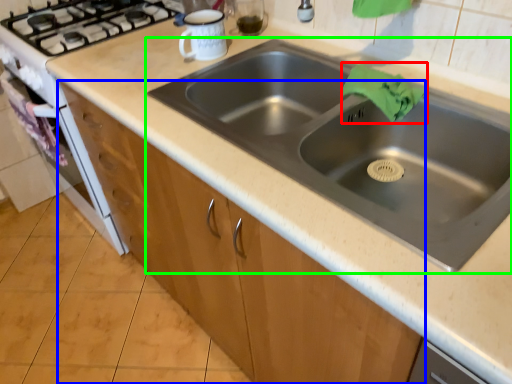
Question: Which is farther away from cloth (highlighted by a red box)? cabinetry (highlighted by a blue box) or sink (highlighted by a green box)?

Choices:
 (A) cabinetry
 (B) sink

Answer: (A)